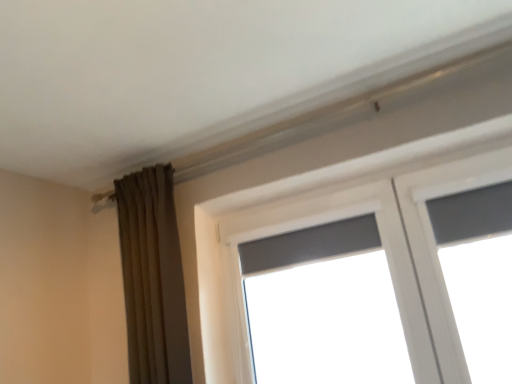
Question: Is matte gray window at center beside brown fabric curtain at left?

Choices:
 (A) no
 (B) yes

Answer: (A)

Question: Is matte gray window at center oriented away from brown fabric curtain at left?

Choices:
 (A) no
 (B) yes

Answer: (A)

Question: Is matte gray window at center smaller than brown fabric curtain at left?

Choices:
 (A) no
 (B) yes

Answer: (B)

Question: Does matte gray window at center have a lesser width compared to brown fabric curtain at left?

Choices:
 (A) no
 (B) yes

Answer: (B)

Question: Is matte gray window at center positioned in front of brown fabric curtain at left?

Choices:
 (A) yes
 (B) no

Answer: (A)

Question: From a real-world perspective, is matte gray window at center on brown fabric curtain at left?

Choices:
 (A) yes
 (B) no

Answer: (B)

Question: Considering the relative sizes of brown fabric curtain at left and matte gray window at center in the image provided, is brown fabric curtain at left taller than matte gray window at center?

Choices:
 (A) no
 (B) yes

Answer: (B)

Question: Considering the relative sizes of brown fabric curtain at left and matte gray window at center in the image provided, is brown fabric curtain at left shorter than matte gray window at center?

Choices:
 (A) yes
 (B) no

Answer: (B)

Question: Considering the relative positions of brown fabric curtain at left and matte gray window at center in the image provided, is brown fabric curtain at left to the right of matte gray window at center from the viewer's perspective?

Choices:
 (A) yes
 (B) no

Answer: (B)

Question: From the image's perspective, is brown fabric curtain at left located beneath matte gray window at center?

Choices:
 (A) yes
 (B) no

Answer: (B)

Question: Is brown fabric curtain at left further to the viewer compared to matte gray window at center?

Choices:
 (A) no
 (B) yes

Answer: (B)

Question: Could you tell me if brown fabric curtain at left is turned towards matte gray window at center?

Choices:
 (A) yes
 (B) no

Answer: (B)

Question: From the image's perspective, is brown fabric curtain at left above or below matte gray window at center?

Choices:
 (A) below
 (B) above

Answer: (B)